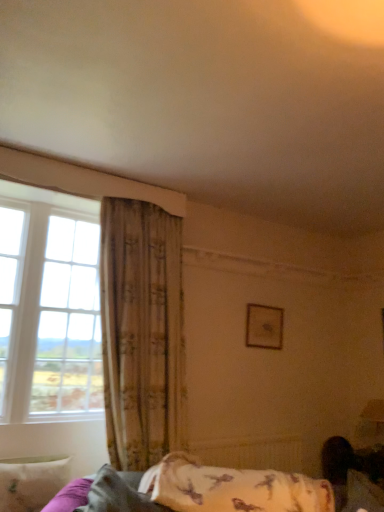
Question: Does white matte radiator at lower center have a greater width compared to textured beige curtain at left?

Choices:
 (A) yes
 (B) no

Answer: (B)

Question: Does white matte radiator at lower center have a lesser height compared to textured beige curtain at left?

Choices:
 (A) yes
 (B) no

Answer: (A)

Question: From a real-world perspective, is white matte radiator at lower center below textured beige curtain at left?

Choices:
 (A) yes
 (B) no

Answer: (A)

Question: From the image's perspective, would you say white matte radiator at lower center is shown under textured beige curtain at left?

Choices:
 (A) yes
 (B) no

Answer: (A)

Question: Is white matte radiator at lower center looking in the opposite direction of textured beige curtain at left?

Choices:
 (A) no
 (B) yes

Answer: (A)

Question: Is white matte radiator at lower center located outside textured beige curtain at left?

Choices:
 (A) yes
 (B) no

Answer: (A)

Question: Is fluffy white pillow at lower right, which is the third pillow in left-to-right order, facing towards white matte radiator at lower center?

Choices:
 (A) yes
 (B) no

Answer: (B)

Question: Can you confirm if fluffy white pillow at lower right, which is counted as the first pillow, starting from the right, is wider than white matte radiator at lower center?

Choices:
 (A) no
 (B) yes

Answer: (B)

Question: Is fluffy white pillow at lower right, which is counted as the first pillow, starting from the right, at the left side of white matte radiator at lower center?

Choices:
 (A) yes
 (B) no

Answer: (B)

Question: From a real-world perspective, is fluffy white pillow at lower right, which is the third pillow in left-to-right order, on white matte radiator at lower center?

Choices:
 (A) yes
 (B) no

Answer: (A)

Question: From a real-world perspective, is fluffy white pillow at lower right, which is counted as the first pillow, starting from the right, positioned under white matte radiator at lower center based on gravity?

Choices:
 (A) yes
 (B) no

Answer: (B)

Question: Is fluffy white pillow at lower right, which is the third pillow in left-to-right order, at the right side of white matte radiator at lower center?

Choices:
 (A) no
 (B) yes

Answer: (B)

Question: Is textured beige curtain at left positioned behind clear glass window at left?

Choices:
 (A) no
 (B) yes

Answer: (B)